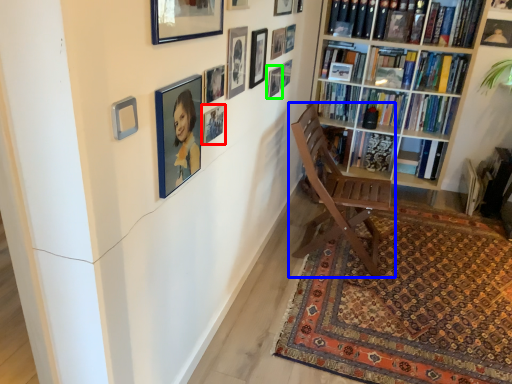
Question: Which object is the farthest from picture frame (highlighted by a red box)? Choose among these: chair (highlighted by a blue box) or picture frame (highlighted by a green box).

Choices:
 (A) chair
 (B) picture frame

Answer: (A)